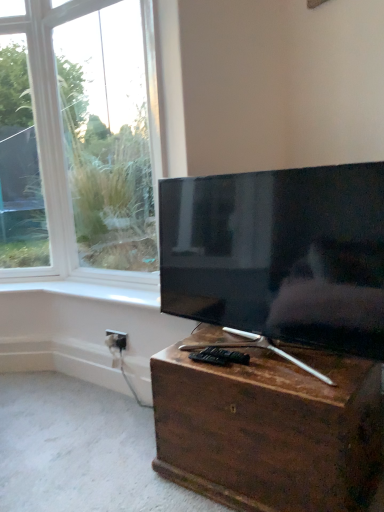
What are the coordinates of `free point above brown wooden chest at lower center (from a real-world perspective)` in the screenshot? It's located at (259, 361).